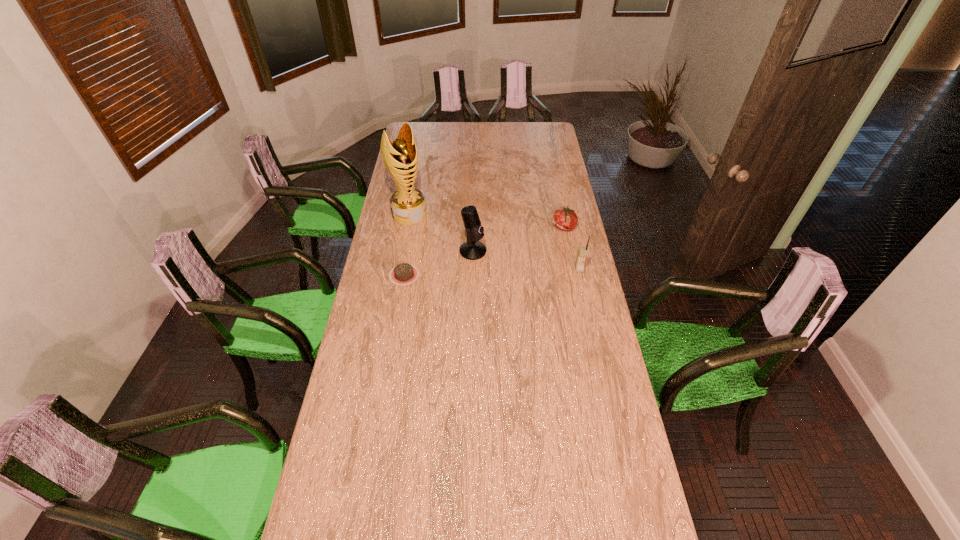
Locate an element on the screen. The height and width of the screenshot is (540, 960). free space located on the front-facing side of the award is located at coordinates (432, 238).

Find the location of a particular element. The width and height of the screenshot is (960, 540). vacant space positioned 0.320m on the front-facing side of the fourth tallest object is located at coordinates (504, 262).

This screenshot has height=540, width=960. Find the location of `vacant space situated 0.370m on the front-facing side of the fourth tallest object`. vacant space situated 0.370m on the front-facing side of the fourth tallest object is located at coordinates (495, 268).

Identify the location of free space located on the front-facing side of the fourth tallest object. (527, 248).

I want to click on free location located 0.230m on the stand of the second tallest object, so click(527, 280).

The height and width of the screenshot is (540, 960). In order to click on blank space located on the stand of the second tallest object in this screenshot , I will do `click(496, 264)`.

Find the location of `free space located 0.380m on the stand of the second tallest object`. free space located 0.380m on the stand of the second tallest object is located at coordinates (558, 298).

You are a GUI agent. You are given a task and a screenshot of the screen. Output one action in this format:
    pyautogui.click(x=<x>, y=<y>)
    Task: Click on the chocolate cake at the left edge
    The image size is (960, 540).
    Given the screenshot: What is the action you would take?
    pyautogui.click(x=403, y=274)

Identify the location of award situated at the left edge. (408, 207).

The width and height of the screenshot is (960, 540). I want to click on cellular telephone that is at the right edge, so click(x=582, y=252).